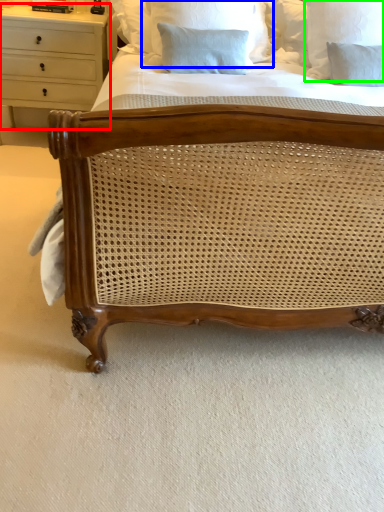
Question: Based on their relative distances, which object is farther from chest of drawers (highlighted by a red box)? Choose from pillow (highlighted by a blue box) and pillow (highlighted by a green box).

Choices:
 (A) pillow
 (B) pillow

Answer: (B)